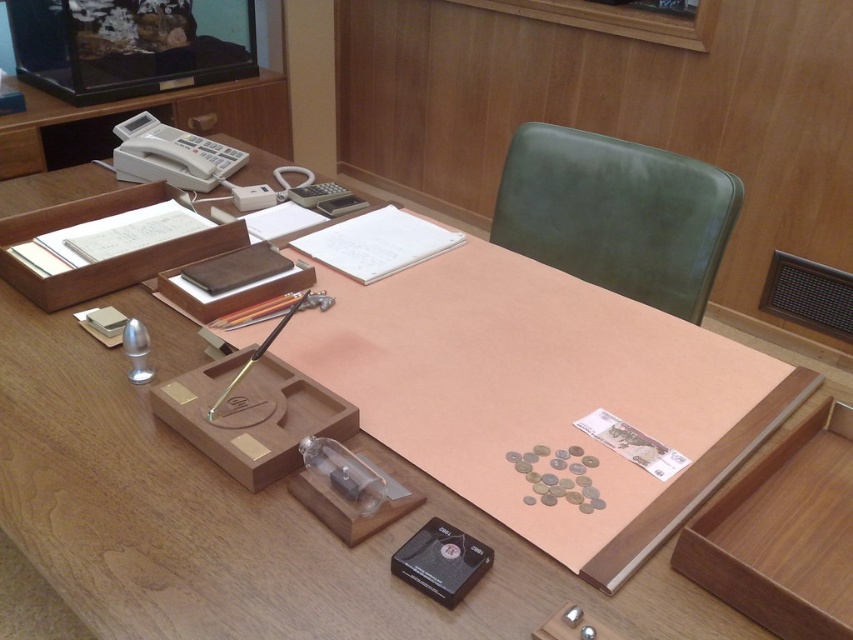
You are a delivery person who needs to place a package on the desk. The package is 30 inches long. Is there enough space on the wooden tray at lower right to place it?

The wooden tray at lower right is 28.71 inches from camera. Since the package is 30 inches long, it is slightly longer than the tray. Therefore, the package may not fit properly on the wooden tray at lower right.

You are a person who is 1.7 meters tall. You are sitting in the green leather chair at upper right and want to reach the desk organizer on the left side. Can you comfortably reach it without leaving your seat?

The distance between the green leather chair at upper right and the desk organizer is 1.46 meters. Since the average arm length for a person of your height is around 0.7 meters, you would not be able to comfortably reach the desk organizer on the left side from your current position.

You need to place a small decorative item on either the wooden tray at lower right or the black plastic tape at lower center. Which surface can accommodate it better based on their sizes?

The wooden tray at lower right is bigger than the black plastic tape at lower center, so it can accommodate the small decorative item better.